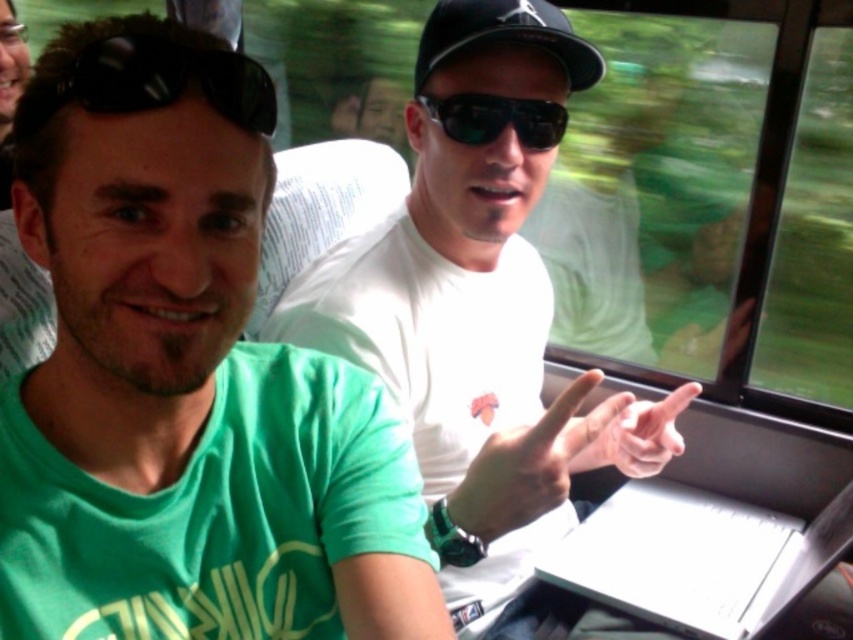
You are a passenger in a moving vehicle and want to take a photo of the white matte shirt at center. Where should you aim your camera to capture the shirt in the frame?

You should aim your camera at the 2D location point at approximately 0.503 on the x axis and 0.562 on the y axis to capture the white matte shirt at center in the frame.

You are a passenger on a moving train and you see the white matte shirt at center and the black matte baseball cap at center. Which object is closer to you?

The white matte shirt at center is closer to you because it is in front of the black matte baseball cap at center.